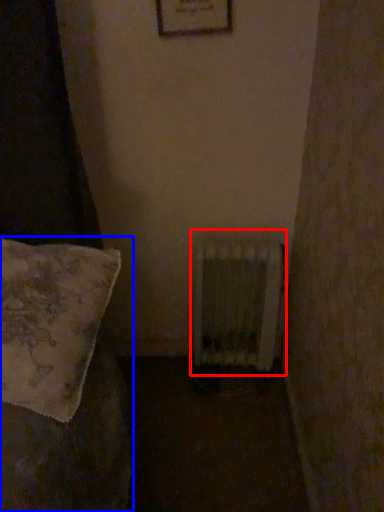
Question: Which object appears closest to the camera in this image, radiator (highlighted by a red box) or furniture (highlighted by a blue box)?

Choices:
 (A) radiator
 (B) furniture

Answer: (B)